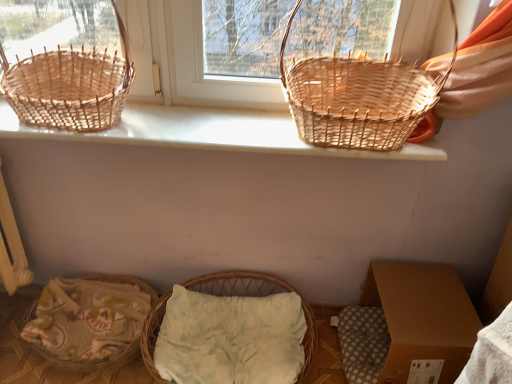
Question: Does brown cardboard box at lower right have a lesser width compared to natural wicker basket at lower left?

Choices:
 (A) no
 (B) yes

Answer: (A)

Question: Is brown cardboard box at lower right shorter than natural wicker basket at lower left?

Choices:
 (A) no
 (B) yes

Answer: (A)

Question: Considering the relative sizes of brown cardboard box at lower right and natural wicker basket at lower left in the image provided, is brown cardboard box at lower right smaller than natural wicker basket at lower left?

Choices:
 (A) no
 (B) yes

Answer: (A)

Question: Does brown cardboard box at lower right appear on the left side of natural wicker basket at lower left?

Choices:
 (A) yes
 (B) no

Answer: (B)

Question: Can you confirm if brown cardboard box at lower right is wider than natural wicker basket at lower left?

Choices:
 (A) no
 (B) yes

Answer: (B)

Question: From a real-world perspective, is brown cardboard box at lower right above or below woven natural basket at upper right, which ranks as the 2th picnic basket in top-to-bottom order?

Choices:
 (A) below
 (B) above

Answer: (A)

Question: In the image, is brown cardboard box at lower right positioned in front of or behind woven natural basket at upper right, which ranks as the 2th picnic basket in top-to-bottom order?

Choices:
 (A) front
 (B) behind

Answer: (B)

Question: Looking at their shapes, would you say brown cardboard box at lower right is wider or thinner than woven natural basket at upper right, marked as the third picnic basket in a left-to-right arrangement?

Choices:
 (A) thin
 (B) wide

Answer: (B)

Question: Considering the positions of brown cardboard box at lower right and woven natural basket at upper right, which ranks as the 2th picnic basket in top-to-bottom order, in the image, is brown cardboard box at lower right taller or shorter than woven natural basket at upper right, which ranks as the 2th picnic basket in top-to-bottom order,?

Choices:
 (A) short
 (B) tall

Answer: (A)

Question: Would you say woven wood baskets at upper center is to the left or to the right of brown cardboard box at lower right in the picture?

Choices:
 (A) right
 (B) left

Answer: (B)

Question: In the image, is woven wood baskets at upper center positioned in front of or behind brown cardboard box at lower right?

Choices:
 (A) behind
 (B) front

Answer: (B)

Question: In terms of size, does woven wood baskets at upper center appear bigger or smaller than brown cardboard box at lower right?

Choices:
 (A) small
 (B) big

Answer: (A)

Question: From the image's perspective, relative to brown cardboard box at lower right, is woven wood baskets at upper center above or below?

Choices:
 (A) above
 (B) below

Answer: (A)

Question: In terms of size, does natural wicker basket at lower left appear bigger or smaller than woven natural basket at left, which appears as the 1th picnic basket when viewed from the top?

Choices:
 (A) small
 (B) big

Answer: (A)

Question: Considering the relative positions of natural wicker basket at lower left and woven natural basket at left, which appears as the 1th picnic basket when viewed from the top, in the image provided, is natural wicker basket at lower left to the left or to the right of woven natural basket at left, which appears as the 1th picnic basket when viewed from the top,?

Choices:
 (A) left
 (B) right

Answer: (A)